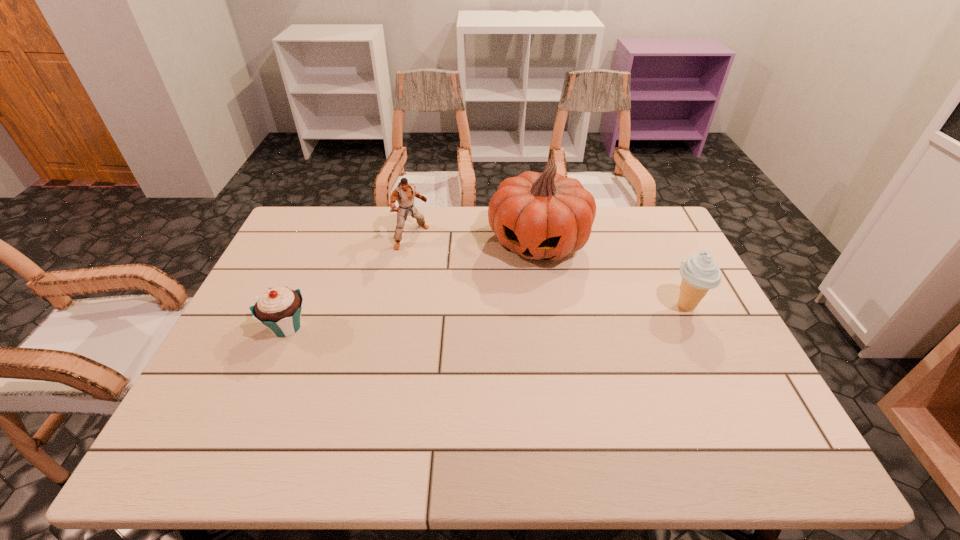
The height and width of the screenshot is (540, 960). Find the location of `vacant space located 0.400m on the front-facing side of the second object from left to right`. vacant space located 0.400m on the front-facing side of the second object from left to right is located at coordinates (511, 316).

This screenshot has width=960, height=540. Identify the location of vacant space located on the face of the second object from right to left. (490, 360).

The height and width of the screenshot is (540, 960). I want to click on vacant space situated 0.220m on the face of the second object from right to left, so click(504, 325).

What are the coordinates of `free space located on the face of the second object from right to left` in the screenshot? It's located at (508, 315).

Identify the location of puncher that is at the far edge. (405, 193).

Where is `pumpkin situated at the far edge`? The width and height of the screenshot is (960, 540). pumpkin situated at the far edge is located at coordinates (540, 216).

Locate an element on the screen. The width and height of the screenshot is (960, 540). object that is at the left edge is located at coordinates (279, 309).

Identify the location of object located in the right edge section of the desktop. The height and width of the screenshot is (540, 960). (699, 272).

This screenshot has width=960, height=540. What are the coordinates of `free location at the far edge of the desktop` in the screenshot? It's located at [x=374, y=208].

In the image, there is a desktop. At what (x,y) coordinates should I click in order to perform the action: click on blank space at the near edge. Please return your answer as a coordinate pair (x, y). The width and height of the screenshot is (960, 540). Looking at the image, I should click on (386, 394).